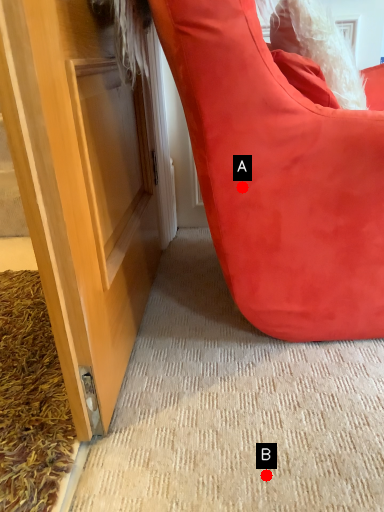
Question: Two points are circled on the image, labeled by A and B beside each circle. Which point is closer to the camera?

Choices:
 (A) A is closer
 (B) B is closer

Answer: (B)